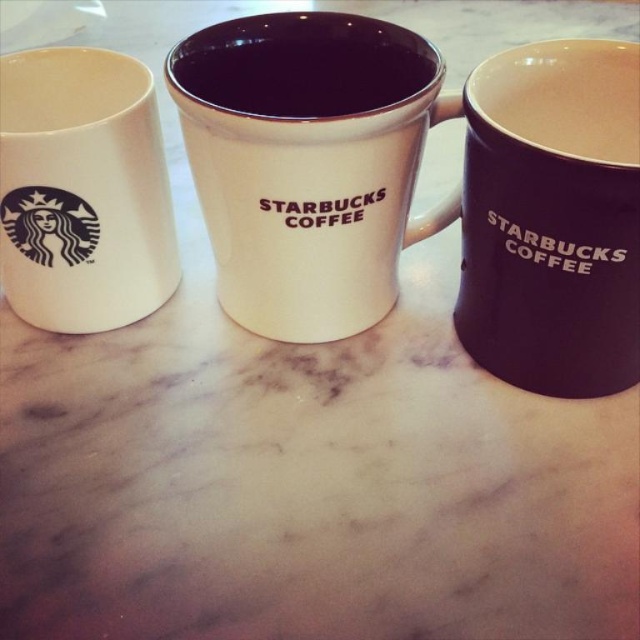
In the scene shown: Can you confirm if white glossy mug at center is positioned to the right of matte ceramic mug at left?

Correct, you'll find white glossy mug at center to the right of matte ceramic mug at left.

Who is positioned more to the right, white glossy mug at center or matte ceramic mug at left?

white glossy mug at center

Is point (404, 161) farther from viewer compared to point (52, 70)?

No, (404, 161) is in front of (52, 70).

You are a GUI agent. You are given a task and a screenshot of the screen. Output one action in this format:
    pyautogui.click(x=<x>, y=<y>)
    Task: Click on the white glossy mug at center
    This screenshot has width=640, height=640.
    Given the screenshot: What is the action you would take?
    point(308,163)

In the scene shown: Can you confirm if matte black mug at right is positioned below matte ceramic mug at left?

Correct, matte black mug at right is located below matte ceramic mug at left.

Does point (570, 51) come in front of point (42, 289)?

That is True.

Where is `matte black mug at right`? matte black mug at right is located at coordinates (552, 218).

Does white glossy mug at center lie in front of matte ceramic mug at center?

That is True.

Can you confirm if white glossy mug at center is wider than matte ceramic mug at center?

Indeed, white glossy mug at center has a greater width compared to matte ceramic mug at center.

Does point (227, 102) lie behind point (289, 64)?

Yes, point (227, 102) is behind point (289, 64).

Where is `white glossy mug at center`? This screenshot has width=640, height=640. white glossy mug at center is located at coordinates (308, 163).